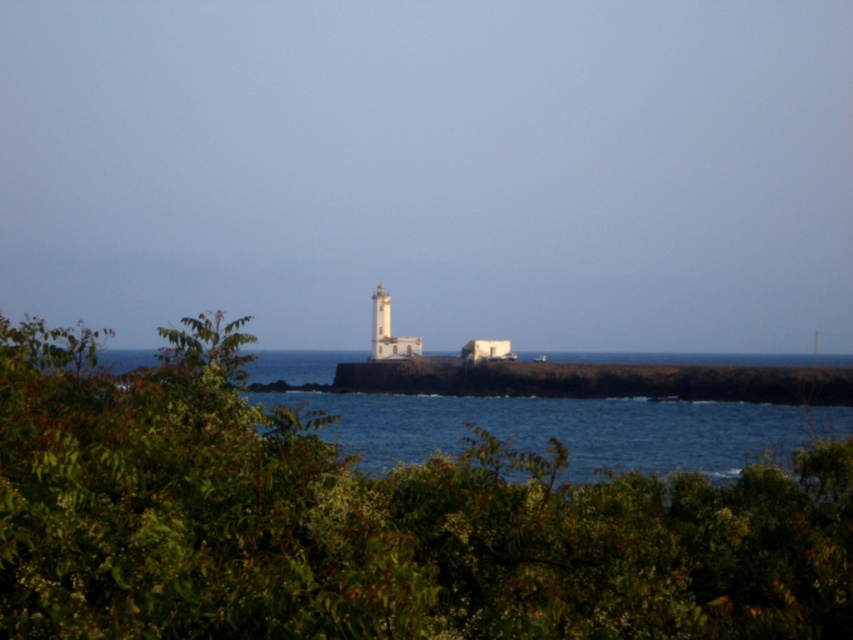
Is blue water at center to the left of white stone wall at center from the viewer's perspective?

In fact, blue water at center is to the right of white stone wall at center.

What do you see at coordinates (546, 422) in the screenshot?
I see `blue water at center` at bounding box center [546, 422].

Where is `blue water at center`? The width and height of the screenshot is (853, 640). blue water at center is located at coordinates (546, 422).

Is green leafy shrub at center positioned at the back of white stone wall at center?

No, green leafy shrub at center is in front of white stone wall at center.

Is point (57, 332) less distant than point (341, 372)?

Yes, point (57, 332) is closer to viewer.

Image resolution: width=853 pixels, height=640 pixels. What are the coordinates of `green leafy shrub at center` in the screenshot? It's located at (370, 522).

Based on the photo, does green leafy shrub at center appear over white concrete lighthouse at center?

No, green leafy shrub at center is not above white concrete lighthouse at center.

What do you see at coordinates (370, 522) in the screenshot? The image size is (853, 640). I see `green leafy shrub at center` at bounding box center [370, 522].

Which is in front, point (512, 488) or point (405, 353)?

Positioned in front is point (512, 488).

In order to click on green leafy shrub at center in this screenshot , I will do `click(370, 522)`.